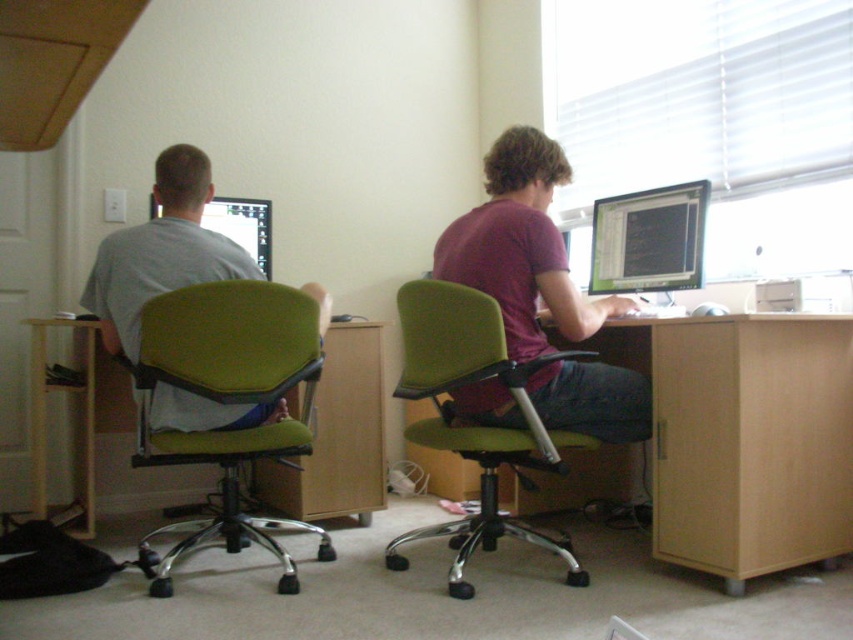
Question: Is light brown wood computer desk at lower right to the right of matte purple shirt at center from the viewer's perspective?

Choices:
 (A) no
 (B) yes

Answer: (B)

Question: Is wooden table at lower left to the right of matte black monitor at left from the viewer's perspective?

Choices:
 (A) yes
 (B) no

Answer: (B)

Question: Based on their relative distances, which object is nearer to the green fabric office chair at left?

Choices:
 (A) green fabric office chair at center
 (B) matte black monitor at upper right
 (C) matte gray shirt at left

Answer: (C)

Question: From the image, what is the correct spatial relationship of light brown wood computer desk at lower right in relation to matte purple shirt at center?

Choices:
 (A) below
 (B) above

Answer: (A)

Question: Which of the following is the closest to the observer?

Choices:
 (A) matte black monitor at upper right
 (B) green fabric office chair at center

Answer: (B)

Question: Which of the following is the closest to the observer?

Choices:
 (A) matte gray shirt at left
 (B) matte purple shirt at center

Answer: (B)